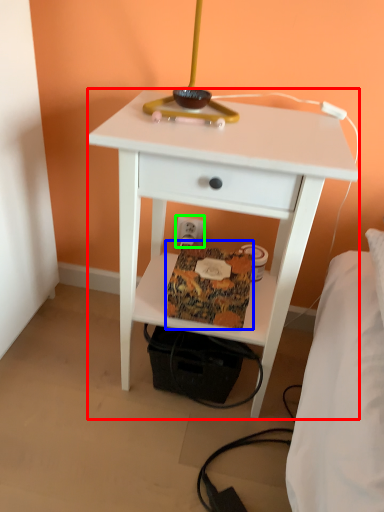
Question: Which is farther away from nightstand (highlighted by a red box)? package (highlighted by a blue box) or electric outlet (highlighted by a green box)?

Choices:
 (A) package
 (B) electric outlet

Answer: (B)